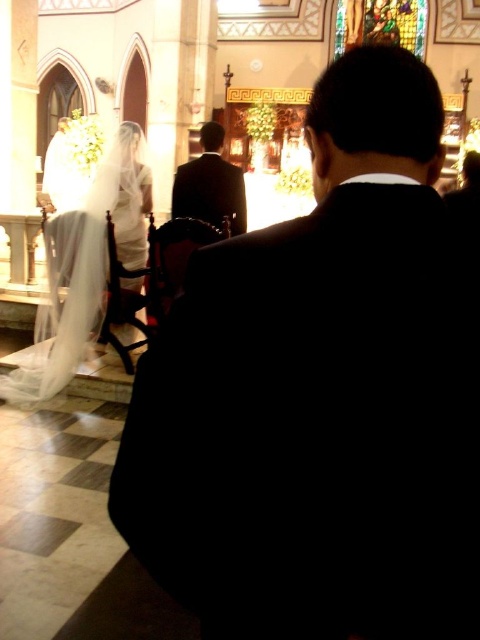
You are attending a wedding and notice two items in the scene. One is the black suit at center and the other is the white sheer veil at upper left. Which item takes up more space in the image?

The white sheer veil at upper left takes up more space in the image since it has a larger size compared to the black suit at center.

You are sitting in the church and want to look at both the point at coordinates point (356, 385) and the point at coordinates point (213, 140). Which point will appear larger in your view?

The point at coordinates point (356, 385) will appear larger because it is closer to the camera than the point at coordinates point (213, 140).

You are a photographer positioned at the back of the church. You need to capture a photo of both the black suit at center and dark suit at center. Since you want to ensure both are visible in the frame, which of the two should you adjust your camera angle to focus on first to account for their sizes?

The black suit at center is wider than the dark suit at center. Therefore, you should focus on the black suit at center first to ensure it fits within the camera frame due to its larger width.